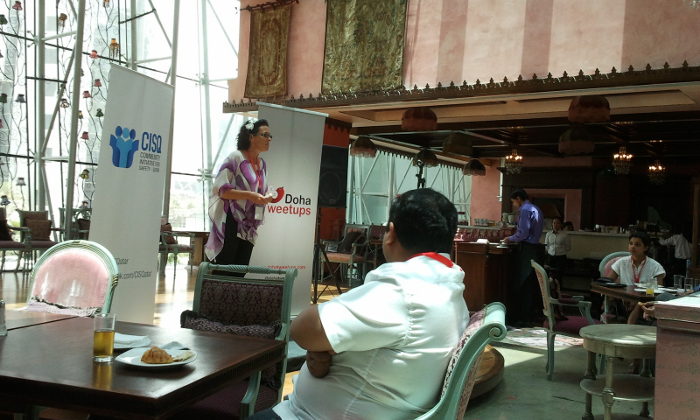
Locate an element on the screen. Image resolution: width=700 pixels, height=420 pixels. table top is located at coordinates (206, 346).